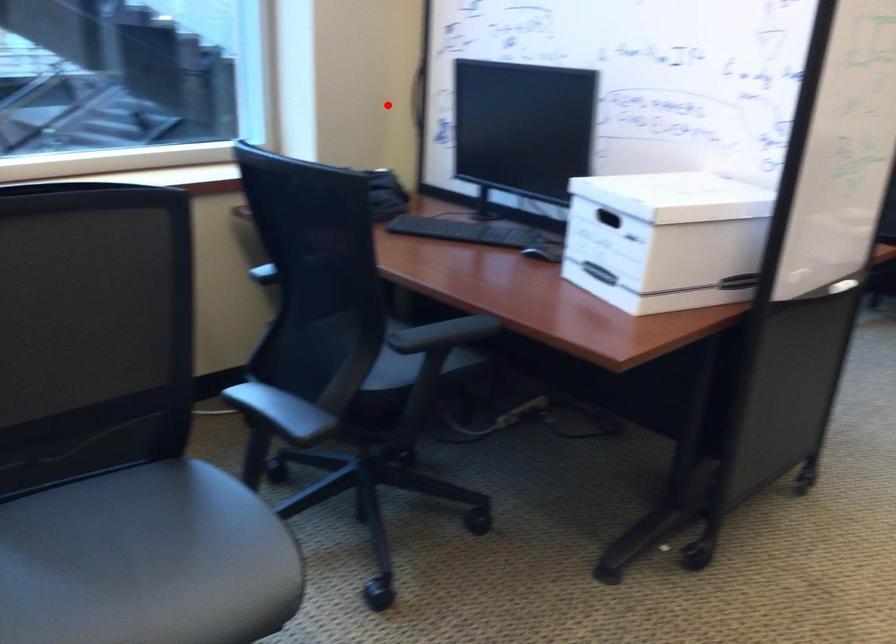
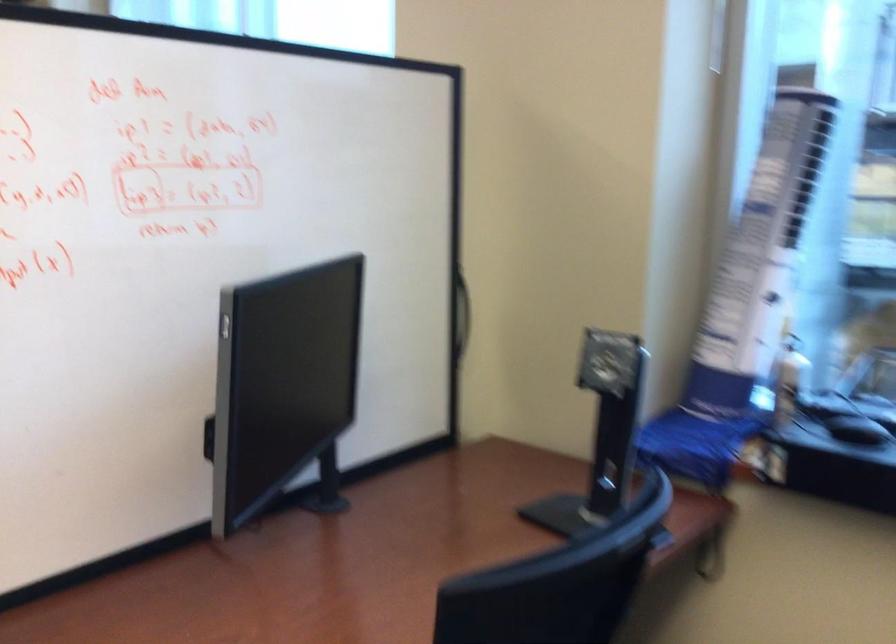
Question: I am providing you with two images of the same scene from different viewpoints. A red point is shown in image1. For the corresponding object point in image2, is it positioned nearer or farther from the camera?

Choices:
 (A) Nearer
 (B) Farther

Answer: (A)